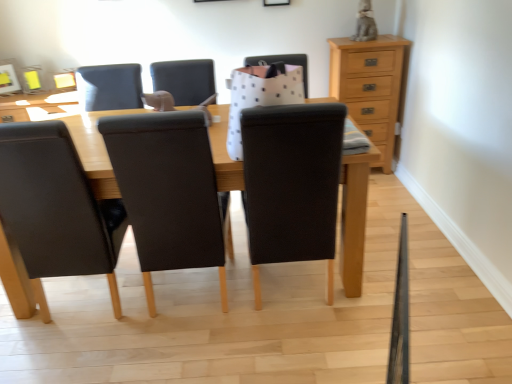
Question: From their relative heights in the image, would you say leather at center, which appears as the second chair when viewed from the left, is taller or shorter than black fabric chair at center, positioned as the first chair in right-to-left order?

Choices:
 (A) tall
 (B) short

Answer: (B)

Question: Visually, is leather at center, positioned as the 2th chair in right-to-left order, positioned to the left or to the right of black fabric chair at center, which ranks as the third chair in left-to-right order?

Choices:
 (A) right
 (B) left

Answer: (B)

Question: Which is nearer to the black fabric chair at center, positioned as the first chair in right-to-left order?

Choices:
 (A) leather at center, positioned as the 2th chair in right-to-left order
 (B) leather at left, the 1th chair from the left
 (C) light brown wood chest of drawers at upper right

Answer: (A)

Question: Which object is positioned farthest from the leather at center, positioned as the 2th chair in right-to-left order?

Choices:
 (A) black fabric chair at center, which ranks as the third chair in left-to-right order
 (B) leather at left, which is the 3th chair in right-to-left order
 (C) light brown wood chest of drawers at upper right

Answer: (C)